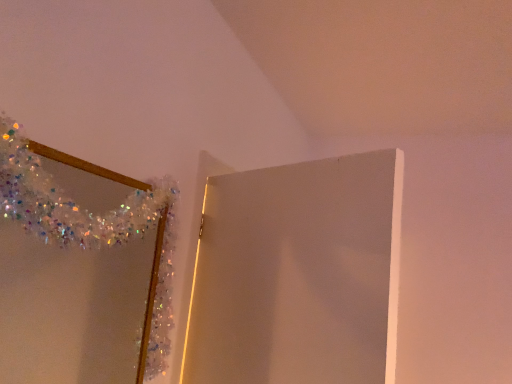
Question: From a real-world perspective, relative to white glossy door at upper center, is shiny metallic mirror at upper left vertically above or below?

Choices:
 (A) above
 (B) below

Answer: (B)

Question: Considering the positions of shiny metallic mirror at upper left and white glossy door at upper center in the image, is shiny metallic mirror at upper left wider or thinner than white glossy door at upper center?

Choices:
 (A) thin
 (B) wide

Answer: (A)

Question: Is shiny metallic mirror at upper left situated inside white glossy door at upper center or outside?

Choices:
 (A) outside
 (B) inside

Answer: (A)

Question: Is white glossy door at upper center taller or shorter than shiny metallic mirror at upper left?

Choices:
 (A) tall
 (B) short

Answer: (A)

Question: Visually, is white glossy door at upper center positioned to the left or to the right of shiny metallic mirror at upper left?

Choices:
 (A) right
 (B) left

Answer: (A)

Question: From the image's perspective, relative to shiny metallic mirror at upper left, is white glossy door at upper center above or below?

Choices:
 (A) below
 (B) above

Answer: (A)

Question: Looking at the image, does white glossy door at upper center seem bigger or smaller compared to shiny metallic mirror at upper left?

Choices:
 (A) big
 (B) small

Answer: (A)